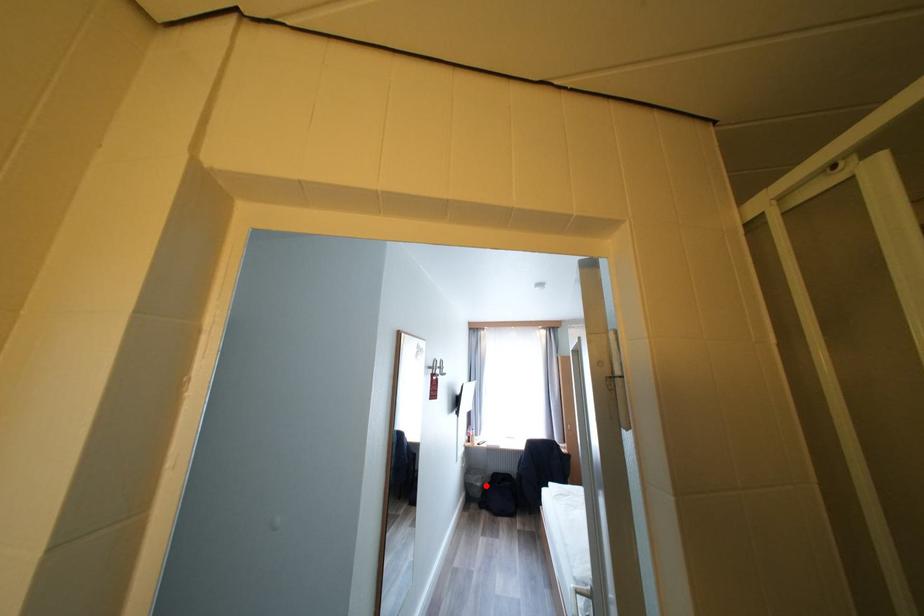
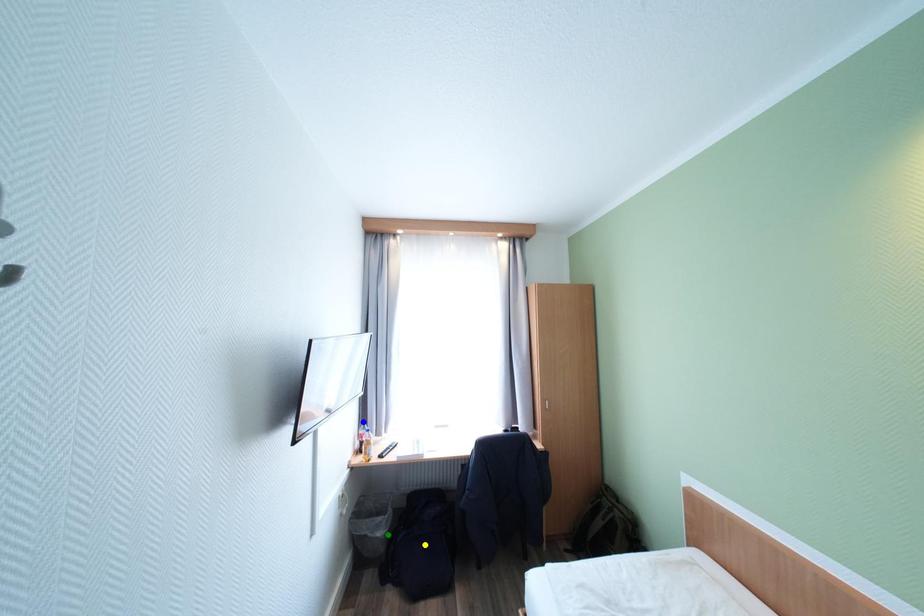
Question: I am providing you with two images of the same scene from different viewpoints. A red point is marked on the first image. You are given multiple points on the second image. Which point in image 2 is actually the same real-world point as the red point in image 1?

Choices:
 (A) blue point
 (B) green point
 (C) yellow point

Answer: (B)